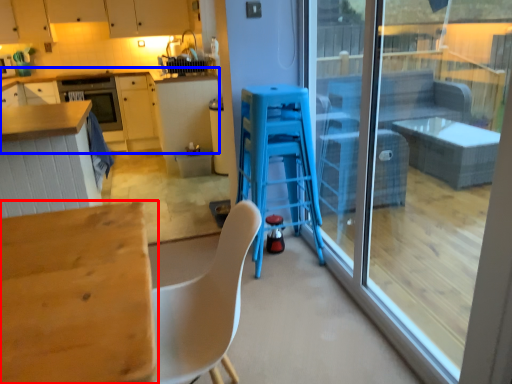
Question: Among these objects, which one is nearest to the camera, table (highlighted by a red box) or cabinetry (highlighted by a blue box)?

Choices:
 (A) table
 (B) cabinetry

Answer: (A)